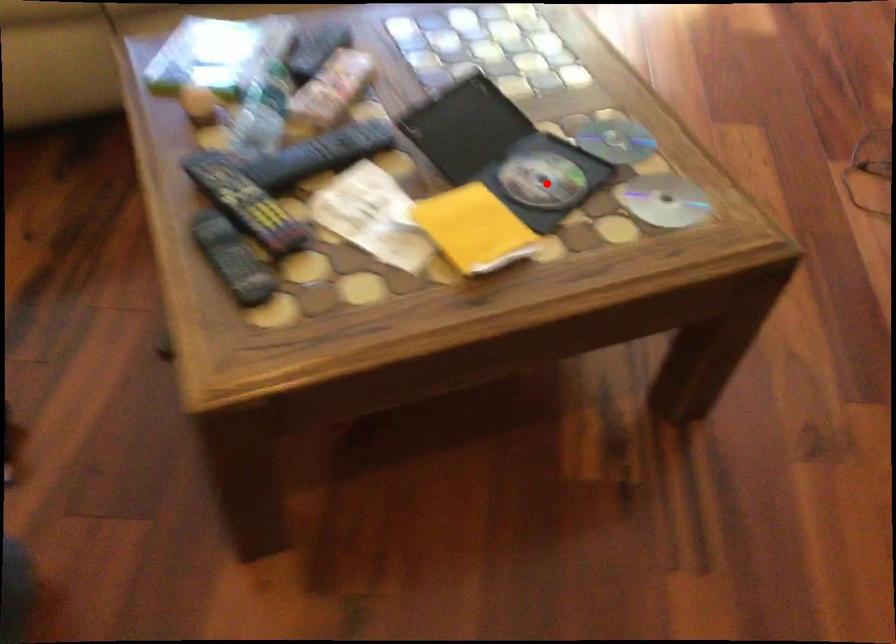
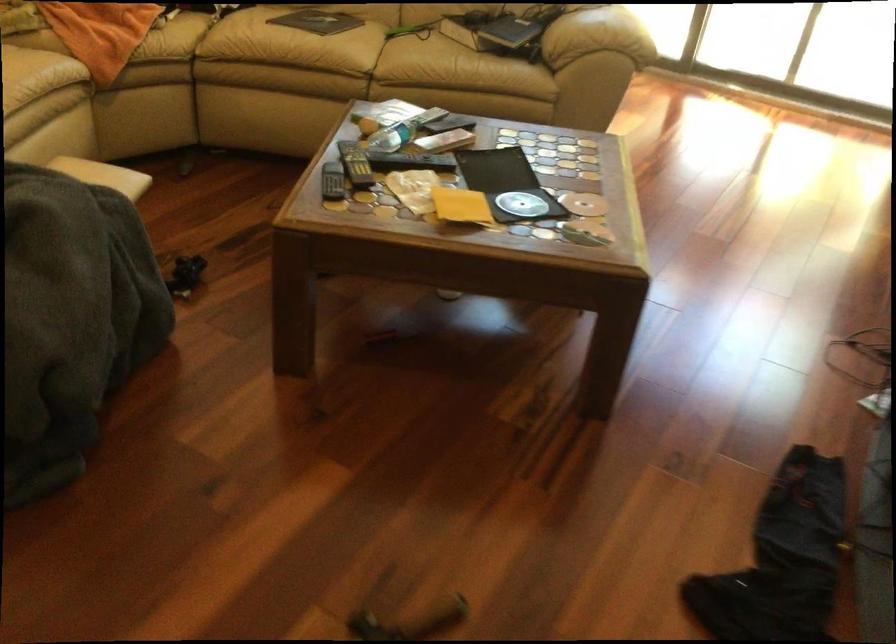
Question: I am providing you with two images of the same scene from different viewpoints. Given a red point in image1, look at the same physical point in image2. Is it:

Choices:
 (A) Closer to the viewpoint
 (B) Farther from the viewpoint

Answer: (B)